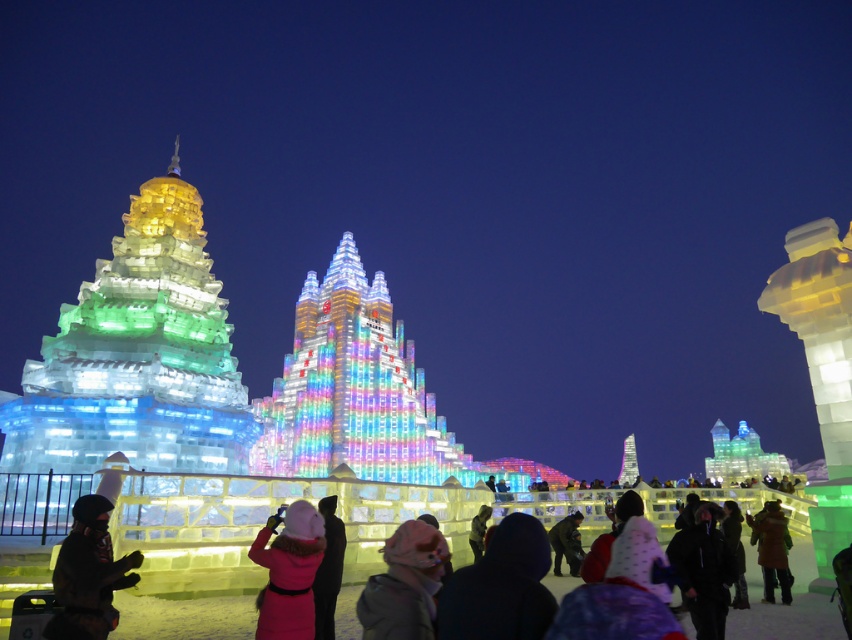
Question: Can you confirm if pink woolen hat at center is bigger than black matte jacket at center?

Choices:
 (A) no
 (B) yes

Answer: (A)

Question: Can you confirm if fuzzy pink hat at center is positioned to the right of green wool coat at center?

Choices:
 (A) yes
 (B) no

Answer: (B)

Question: Which object appears farthest from the camera in this image?

Choices:
 (A) fuzzy pink hat at center
 (B) black matte jacket at center
 (C) green wool coat at center
 (D) pink woolen hat at center

Answer: (C)

Question: Which point appears farthest from the camera in this image?

Choices:
 (A) pyautogui.click(x=757, y=516)
 (B) pyautogui.click(x=700, y=593)

Answer: (A)

Question: Does black matte jacket at center appear on the left side of green wool coat at center?

Choices:
 (A) no
 (B) yes

Answer: (B)

Question: Which of these objects is positioned closest to the black matte jacket at center?

Choices:
 (A) green wool coat at center
 (B) fuzzy pink hat at center
 (C) pink woolen hat at center

Answer: (A)